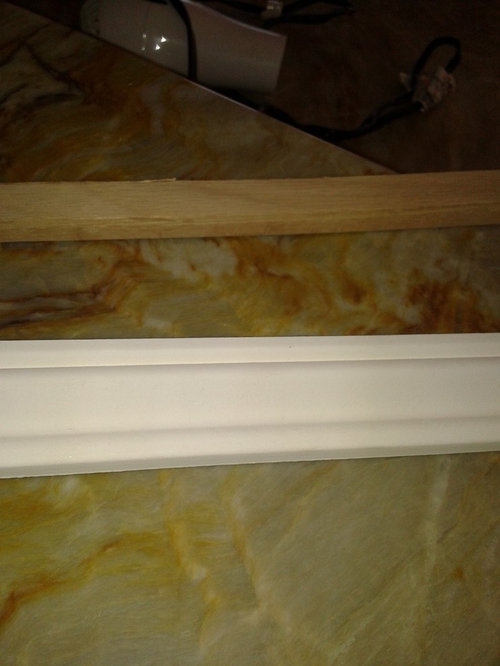
Find the location of a particular element. reflective light on hairdryer is located at coordinates pos(161,38), pos(158,48), pos(144,34), pos(143,45).